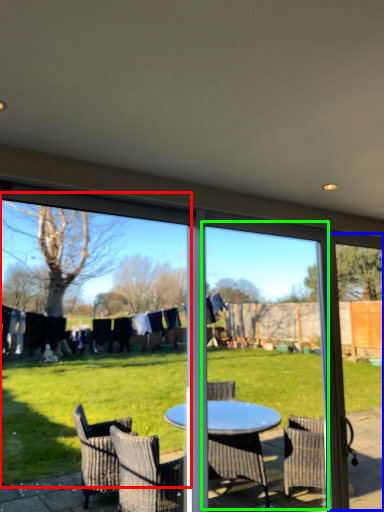
Question: Which object is the closest to the window screen (highlighted by a red box)? Choose among these: screen door (highlighted by a blue box) or screen door (highlighted by a green box).

Choices:
 (A) screen door
 (B) screen door

Answer: (B)